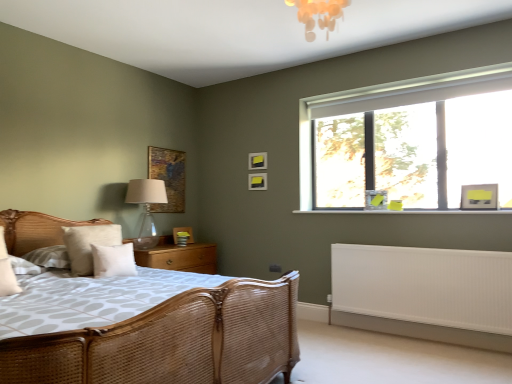
Locate an element on the screen. This screenshot has width=512, height=384. matte gray picture frame at right, marked as the fifth picture frame in a left-to-right arrangement is located at coordinates (479, 197).

This screenshot has height=384, width=512. I want to click on matte black picture frame at upper center, which ranks as the 4th picture frame in front-to-back order, so click(x=258, y=160).

I want to click on white soft pillow at center, the 1th pillow positioned from the right, so click(x=113, y=260).

Is clear glass window at upper right oriented away from matte gray picture frame at right, marked as the 1th picture frame in a right-to-left arrangement?

Yes, clear glass window at upper right is positioned with its back facing matte gray picture frame at right, marked as the 1th picture frame in a right-to-left arrangement.

Are clear glass window at upper right and matte gray picture frame at right, marked as the 1th picture frame in a right-to-left arrangement, far apart?

They are positioned close to each other.

From the image's perspective, is clear glass window at upper right above matte gray picture frame at right, the 1th picture frame positioned from the front?

Yes, from the image's perspective, clear glass window at upper right is over matte gray picture frame at right, the 1th picture frame positioned from the front.

Consider the image. Would you say clear glass window at upper right is outside matte gray picture frame at right, which is counted as the fifth picture frame, starting from the back?

Yes, clear glass window at upper right is not within matte gray picture frame at right, which is counted as the fifth picture frame, starting from the back.

Considering the points (189, 232) and (282, 286), which point is in front, point (189, 232) or point (282, 286)?

Point (282, 286)

Is wooden picture frame at lower center, the second picture frame positioned from the left, completely or partially outside of woven rattan bed at left?

Yes, wooden picture frame at lower center, the second picture frame positioned from the left, is not within woven rattan bed at left.

Where is `the 2nd picture frame counting from the right of the woven rattan bed at left`? The image size is (512, 384). the 2nd picture frame counting from the right of the woven rattan bed at left is located at coordinates (183, 231).

From a real-world perspective, which object stands above the other?

From a 3D spatial view, wooden picture frame at lower center, which is counted as the 1th picture frame, starting from the back, is above.

Identify the location of table lamp on the left of matte gray picture frame at right, which is counted as the fifth picture frame, starting from the back. This screenshot has width=512, height=384. (146, 209).

How far apart are translucent glass table lamp at left and matte gray picture frame at right, the 1th picture frame positioned from the front?

translucent glass table lamp at left is 3.27 meters away from matte gray picture frame at right, the 1th picture frame positioned from the front.

Is translucent glass table lamp at left behind matte gray picture frame at right, marked as the fifth picture frame in a left-to-right arrangement?

Yes, translucent glass table lamp at left is behind matte gray picture frame at right, marked as the fifth picture frame in a left-to-right arrangement.

From the image's perspective, is translucent glass table lamp at left on top of matte gray picture frame at right, the 1th picture frame positioned from the front?

Actually, translucent glass table lamp at left appears below matte gray picture frame at right, the 1th picture frame positioned from the front, in the image.

Are clear glass window at upper right and woven rattan bed at left located far from each other?

That's right, there is a large distance between clear glass window at upper right and woven rattan bed at left.

Is woven rattan bed at left completely or partially inside clear glass window at upper right?

That's incorrect, woven rattan bed at left is not inside clear glass window at upper right.

This screenshot has width=512, height=384. I want to click on bed below the clear glass window at upper right (from the image's perspective), so click(173, 341).

Does clear glass window at upper right have a greater height compared to woven rattan bed at left?

Correct, clear glass window at upper right is much taller as woven rattan bed at left.

From the image's perspective, between matte black picture frame at upper center, which appears as the 3th picture frame when viewed from the right, and wooden textured picture frame at upper center, acting as the 1th picture frame starting from the left, which one is located above?

wooden textured picture frame at upper center, acting as the 1th picture frame starting from the left, is shown above in the image.

Looking at their sizes, would you say matte black picture frame at upper center, the 3th picture frame from the left, is wider or thinner than wooden textured picture frame at upper center, the second picture frame viewed from the front?

In the image, matte black picture frame at upper center, the 3th picture frame from the left, appears to be wider than wooden textured picture frame at upper center, the second picture frame viewed from the front.

Would you say matte black picture frame at upper center, which is the 3th picture frame from front to back, is a long distance from wooden textured picture frame at upper center, acting as the 1th picture frame starting from the left?

No, matte black picture frame at upper center, which is the 3th picture frame from front to back, is not far away from wooden textured picture frame at upper center, acting as the 1th picture frame starting from the left.

Is matte black picture frame at upper center, the 3th picture frame from the left, bigger or smaller than wooden textured picture frame at upper center, acting as the 1th picture frame starting from the left?

Clearly, matte black picture frame at upper center, the 3th picture frame from the left, is smaller in size than wooden textured picture frame at upper center, acting as the 1th picture frame starting from the left.

In the scene shown: Considering the sizes of matte gray picture frame at right, the 1th picture frame positioned from the front, and white ribbed radiator at lower right in the image, is matte gray picture frame at right, the 1th picture frame positioned from the front, wider or thinner than white ribbed radiator at lower right?

matte gray picture frame at right, the 1th picture frame positioned from the front, is thinner than white ribbed radiator at lower right.

From a real-world perspective, is matte gray picture frame at right, marked as the 1th picture frame in a right-to-left arrangement, physically located above or below white ribbed radiator at lower right?

From a real-world perspective, matte gray picture frame at right, marked as the 1th picture frame in a right-to-left arrangement, is physically above white ribbed radiator at lower right.

Which object is closer to the camera taking this photo, matte gray picture frame at right, marked as the fifth picture frame in a left-to-right arrangement, or white ribbed radiator at lower right?

Positioned in front is white ribbed radiator at lower right.

Based on the photo, how distant is woven rattan bed at left from white soft pillow at center, the 1th pillow positioned from the right?

A distance of 3.79 feet exists between woven rattan bed at left and white soft pillow at center, the 1th pillow positioned from the right.

Which object is more forward, woven rattan bed at left or white soft pillow at center, acting as the second pillow starting from the left?

woven rattan bed at left is more forward.

This screenshot has width=512, height=384. In order to click on the 1st pillow behind the woven rattan bed at left, starting your count from the anchor in this screenshot , I will do `click(113, 260)`.

From a real-world perspective, is woven rattan bed at left over white soft pillow at center, acting as the second pillow starting from the left?

No, from a real-world perspective, woven rattan bed at left is not over white soft pillow at center, acting as the second pillow starting from the left

Find the location of `window that is on the left side of matte gray picture frame at right, marked as the fifth picture frame in a left-to-right arrangement`. window that is on the left side of matte gray picture frame at right, marked as the fifth picture frame in a left-to-right arrangement is located at coordinates (411, 141).

Identify the location of the 1st picture frame positioned above the woven rattan bed at left (from a real-world perspective). The width and height of the screenshot is (512, 384). (183, 231).

Which object lies further to the anchor point matte black picture frame at upper center, the second picture frame when ordered from back to front, white soft pillow at center, the 1th pillow positioned from the right, or matte gray picture frame at right, the 1th picture frame positioned from the front?

The object further to matte black picture frame at upper center, the second picture frame when ordered from back to front, is matte gray picture frame at right, the 1th picture frame positioned from the front.

Consider the image. When comparing their distances from white ribbed radiator at lower right, does woven rattan bed at left or matte black picture frame at upper center, which appears as the 3th picture frame when viewed from the right, seem further?

The object further to white ribbed radiator at lower right is matte black picture frame at upper center, which appears as the 3th picture frame when viewed from the right.

Consider the image. From the image, which object appears to be farther from translucent glass table lamp at left, white soft pillow at center, acting as the second pillow starting from the left, or wooden at left?

Based on the image, white soft pillow at center, acting as the second pillow starting from the left, appears to be further to translucent glass table lamp at left.

Considering their positions, is matte black picture frame at upper center, which ranks as the fourth picture frame in left-to-right order, positioned closer to translucent glass table lamp at left than wooden picture frame at lower center, which appears as the fifth picture frame when viewed from the front?

Based on the image, wooden picture frame at lower center, which appears as the fifth picture frame when viewed from the front, appears to be nearer to translucent glass table lamp at left.

Considering their positions, is matte gray picture frame at right, marked as the fifth picture frame in a left-to-right arrangement, positioned further to translucent glass table lamp at left than matte black picture frame at upper center, which is the 3th picture frame from front to back?

matte gray picture frame at right, marked as the fifth picture frame in a left-to-right arrangement, lies further to translucent glass table lamp at left than the other object.

From the picture: When comparing their distances from beige fabric pillow at left, which is counted as the first pillow, starting from the left, does wooden textured picture frame at upper center, acting as the 1th picture frame starting from the left, or woven rattan bed at left seem further?

woven rattan bed at left lies further to beige fabric pillow at left, which is counted as the first pillow, starting from the left, than the other object.

Based on their spatial positions, is matte black picture frame at upper center, which appears as the 3th picture frame when viewed from the right, or wooden picture frame at lower center, the second picture frame positioned from the left, closer to wooden at left?

wooden picture frame at lower center, the second picture frame positioned from the left.

From the image, which object appears to be farther from beige fabric pillow at left, which is counted as the first pillow, starting from the left, wooden at left or matte black picture frame at upper center, which ranks as the fourth picture frame in left-to-right order?

matte black picture frame at upper center, which ranks as the fourth picture frame in left-to-right order, lies further to beige fabric pillow at left, which is counted as the first pillow, starting from the left, than the other object.

The height and width of the screenshot is (384, 512). Identify the location of table lamp between beige fabric pillow at left, which is counted as the first pillow, starting from the left, and white ribbed radiator at lower right, in the horizontal direction. (146, 209).

Where is `window between matte black picture frame at upper center, the second picture frame when ordered from back to front, and matte gray picture frame at right, which is counted as the fifth picture frame, starting from the back, in the horizontal direction`? window between matte black picture frame at upper center, the second picture frame when ordered from back to front, and matte gray picture frame at right, which is counted as the fifth picture frame, starting from the back, in the horizontal direction is located at coordinates (411, 141).

I want to click on nightstand between translucent glass table lamp at left and wooden picture frame at lower center, the second picture frame positioned from the left, in the front-back direction, so click(177, 256).

I want to click on radiator located between translucent glass table lamp at left and matte gray picture frame at right, marked as the fifth picture frame in a left-to-right arrangement, in the left-right direction, so click(425, 293).